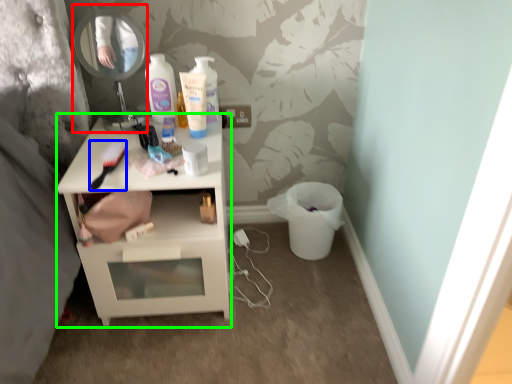
Question: Which is nearer to the mirror (highlighted by a red box)? brush (highlighted by a blue box) or nightstand (highlighted by a green box).

Choices:
 (A) brush
 (B) nightstand

Answer: (A)